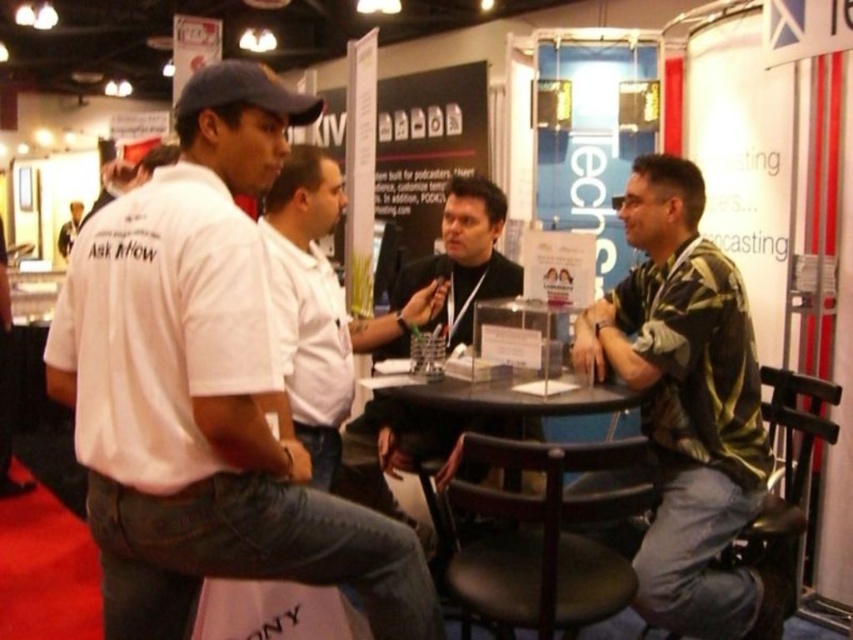
You are at the trade show booth and want to approach the person in the white shirt at left to ask a question. Which direction should you move relative to the black leather jacket at center?

Since the black leather jacket at center is closer to you than the white shirt at left, you should move away from the black leather jacket at center to reach the white shirt at left.